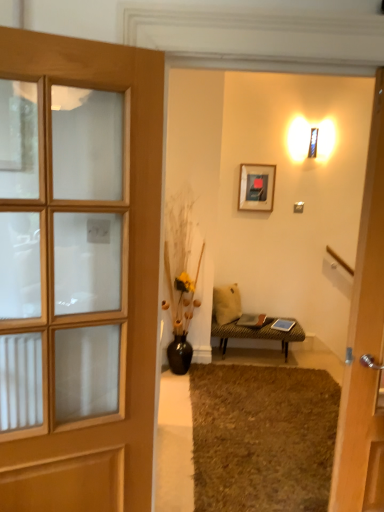
Question: Considering the positions of beige fabric pillow at center and brown shaggy rug at lower center in the image, is beige fabric pillow at center taller or shorter than brown shaggy rug at lower center?

Choices:
 (A) short
 (B) tall

Answer: (B)

Question: Considering the relative positions of beige fabric pillow at center and brown shaggy rug at lower center in the image provided, is beige fabric pillow at center to the left or to the right of brown shaggy rug at lower center?

Choices:
 (A) right
 (B) left

Answer: (B)

Question: Which is nearer to the beige fabric pillow at center?

Choices:
 (A) leather textured bench at center
 (B) matte black picture frame at upper center
 (C) black ceramic vase at center
 (D) brown shaggy rug at lower center
 (E) wooden door at left

Answer: (A)

Question: Which is farther from the brown shaggy rug at lower center?

Choices:
 (A) leather textured bench at center
 (B) matte black picture frame at upper center
 (C) wooden door at left
 (D) black ceramic vase at center
 (E) beige fabric pillow at center

Answer: (B)